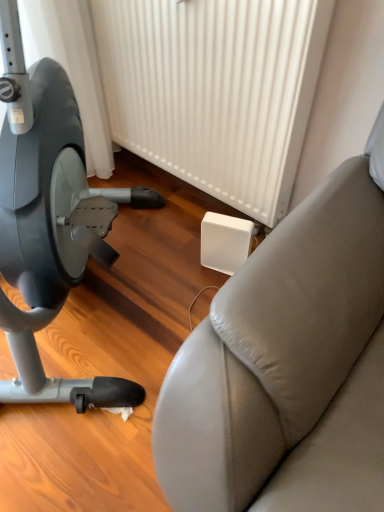
Measure the distance between point (33, 89) and camera.

Point (33, 89) is 1.08 meters from camera.

From the picture: What is the approximate width of leather-like studio couch at right?

1.21 meters.

This screenshot has height=512, width=384. Describe the element at coordinates (214, 90) in the screenshot. I see `white plastic radiator at center` at that location.

The image size is (384, 512). Identify the location of matte gray stationary bicycle at left. (50, 220).

Is matte gray stationary bicycle at left oriented towards leather-like studio couch at right?

No, matte gray stationary bicycle at left is not facing towards leather-like studio couch at right.

Does matte gray stationary bicycle at left have a lesser width compared to leather-like studio couch at right?

Indeed, matte gray stationary bicycle at left has a lesser width compared to leather-like studio couch at right.

Where is `studio couch lying on the right of matte gray stationary bicycle at left`? studio couch lying on the right of matte gray stationary bicycle at left is located at coordinates (288, 364).

From a real-world perspective, is matte gray stationary bicycle at left on top of leather-like studio couch at right?

Yes.

Is matte gray stationary bicycle at left bigger than white plastic radiator at center?

Yes, matte gray stationary bicycle at left is bigger than white plastic radiator at center.

Could you tell me if matte gray stationary bicycle at left is turned towards white plastic radiator at center?

No, matte gray stationary bicycle at left does not turn towards white plastic radiator at center.

Which point is more forward, (18, 136) or (272, 61)?

Point (18, 136)

Is the position of matte gray stationary bicycle at left less distant than that of white plastic radiator at center?

Yes, matte gray stationary bicycle at left is closer to the viewer.

Is leather-like studio couch at right turned away from matte gray stationary bicycle at left?

No, leather-like studio couch at right's orientation is not away from matte gray stationary bicycle at left.

Between leather-like studio couch at right and matte gray stationary bicycle at left, which one has more height?

matte gray stationary bicycle at left.

Is leather-like studio couch at right completely or partially outside of matte gray stationary bicycle at left?

Absolutely, leather-like studio couch at right is external to matte gray stationary bicycle at left.

How far apart are leather-like studio couch at right and matte gray stationary bicycle at left?

leather-like studio couch at right is 23.00 inches away from matte gray stationary bicycle at left.

From a real-world perspective, between white plastic radiator at center and leather-like studio couch at right, who is vertically lower?

leather-like studio couch at right is physically lower.

Based on the photo, from the image's perspective, which object appears higher, white plastic radiator at center or leather-like studio couch at right?

white plastic radiator at center.

Who is bigger, white plastic radiator at center or leather-like studio couch at right?

white plastic radiator at center is bigger.

Looking at this image, can you confirm if white plastic radiator at center is thinner than leather-like studio couch at right?

Yes.

What are the coordinates of `studio couch lying in front of the white plastic radiator at center` in the screenshot? It's located at (288, 364).

Could you tell me if leather-like studio couch at right is facing white plastic radiator at center?

No.

Is matte gray stationary bicycle at left a part of white plastic radiator at center?

No, white plastic radiator at center does not contain matte gray stationary bicycle at left.

Considering the positions of points (208, 93) and (7, 303), is point (208, 93) farther from camera compared to point (7, 303)?

Yes, point (208, 93) is behind point (7, 303).

Is white plastic radiator at center in front of or behind matte gray stationary bicycle at left in the image?

Clearly, white plastic radiator at center is behind matte gray stationary bicycle at left.

Image resolution: width=384 pixels, height=512 pixels. In order to click on stationary bicycle on the left of leather-like studio couch at right in this screenshot , I will do `click(50, 220)`.

Where is `stationary bicycle above the white plastic radiator at center (from a real-world perspective)`? The width and height of the screenshot is (384, 512). stationary bicycle above the white plastic radiator at center (from a real-world perspective) is located at coordinates pyautogui.click(x=50, y=220).

Considering their positions, is white plastic radiator at center positioned closer to leather-like studio couch at right than matte gray stationary bicycle at left?

Among the two, matte gray stationary bicycle at left is located nearer to leather-like studio couch at right.

Based on their spatial positions, is leather-like studio couch at right or matte gray stationary bicycle at left closer to white plastic radiator at center?

matte gray stationary bicycle at left is positioned closer to the anchor white plastic radiator at center.

When comparing their distances from white plastic radiator at center, does matte gray stationary bicycle at left or leather-like studio couch at right seem further?

Among the two, leather-like studio couch at right is located further to white plastic radiator at center.

Estimate the real-world distances between objects in this image. Which object is closer to matte gray stationary bicycle at left, leather-like studio couch at right or white plastic radiator at center?

Answer: white plastic radiator at center is closer to matte gray stationary bicycle at left.

Looking at the image, which one is located closer to matte gray stationary bicycle at left, white plastic radiator at center or leather-like studio couch at right?

Among the two, white plastic radiator at center is located nearer to matte gray stationary bicycle at left.

When comparing their distances from leather-like studio couch at right, does matte gray stationary bicycle at left or white plastic radiator at center seem further?

Based on the image, white plastic radiator at center appears to be further to leather-like studio couch at right.

Where is `stationary bicycle that lies between white plastic radiator at center and leather-like studio couch at right from top to bottom`? stationary bicycle that lies between white plastic radiator at center and leather-like studio couch at right from top to bottom is located at coordinates (50, 220).